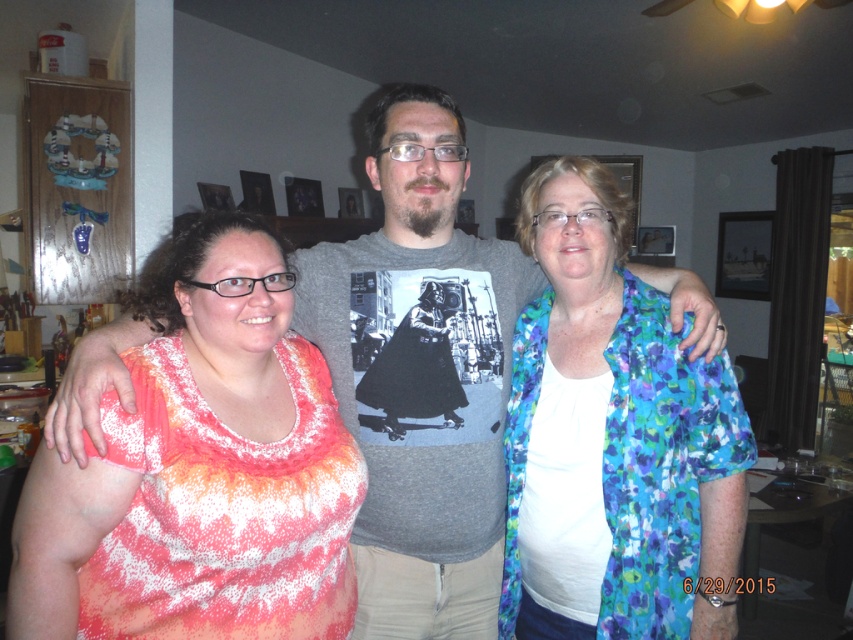
Question: Which of the following is the closest to the observer?

Choices:
 (A) (250, 449)
 (B) (738, 472)

Answer: (A)

Question: Which object is the farthest from the tie-dye fabric shirt at left?

Choices:
 (A) gray cotton t-shirt at center
 (B) blue floral shirt at center

Answer: (B)

Question: Is tie-dye fabric shirt at left positioned in front of gray cotton t-shirt at center?

Choices:
 (A) yes
 (B) no

Answer: (A)

Question: In this image, where is blue floral shirt at center located relative to gray cotton t-shirt at center?

Choices:
 (A) below
 (B) above

Answer: (A)

Question: Is tie-dye fabric shirt at left behind blue floral shirt at center?

Choices:
 (A) yes
 (B) no

Answer: (B)

Question: Which point is farther from the camera taking this photo?

Choices:
 (A) (544, 346)
 (B) (207, 356)

Answer: (A)